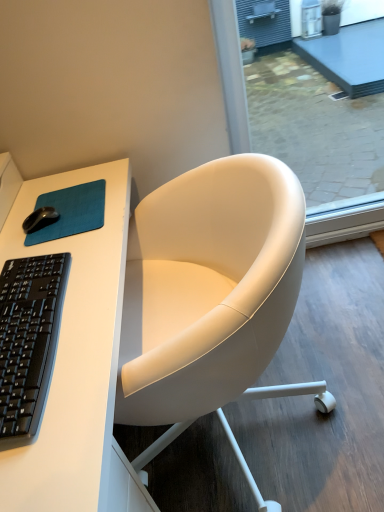
Where is `vacant area on top of black matte keyboard at left (from a real-world perspective)`? vacant area on top of black matte keyboard at left (from a real-world perspective) is located at coordinates (24, 305).